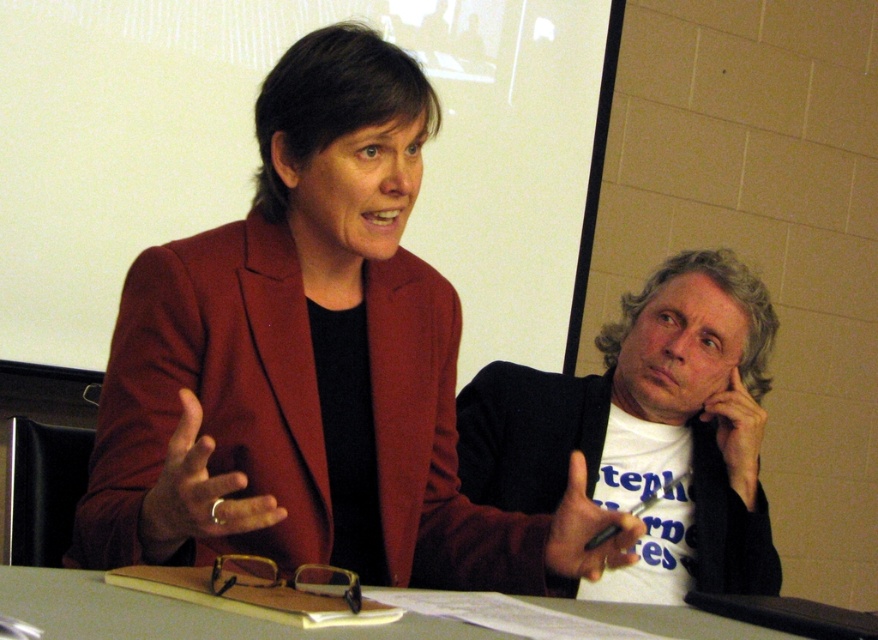
Is the position of white cotton t-shirt at right less distant than that of smooth skin hand at upper right?

Yes, white cotton t-shirt at right is closer to the viewer.

Is white cotton t-shirt at right thinner than smooth skin hand at upper right?

No, white cotton t-shirt at right is not thinner than smooth skin hand at upper right.

The height and width of the screenshot is (640, 878). What do you see at coordinates (645, 432) in the screenshot?
I see `white cotton t-shirt at right` at bounding box center [645, 432].

Find the location of a particular element. The width and height of the screenshot is (878, 640). white cotton t-shirt at right is located at coordinates (645, 432).

Is black matte pen at center bigger than smooth skin hand at upper right?

Actually, black matte pen at center might be smaller than smooth skin hand at upper right.

Between black matte pen at center and smooth skin hand at upper right, which one is positioned lower?

black matte pen at center is below.

Is point (589, 522) positioned after point (724, 397)?

No, (589, 522) is in front of (724, 397).

Identify the location of black matte pen at center. The image size is (878, 640). [587, 531].

Is matte red jacket at center above black matte pen at center?

Yes, matte red jacket at center is above black matte pen at center.

How much distance is there between matte red jacket at center and black matte pen at center?

matte red jacket at center and black matte pen at center are 16.94 inches apart from each other.

This screenshot has height=640, width=878. Identify the location of matte red jacket at center. (198, 493).

The height and width of the screenshot is (640, 878). Identify the location of matte red jacket at center. (198, 493).